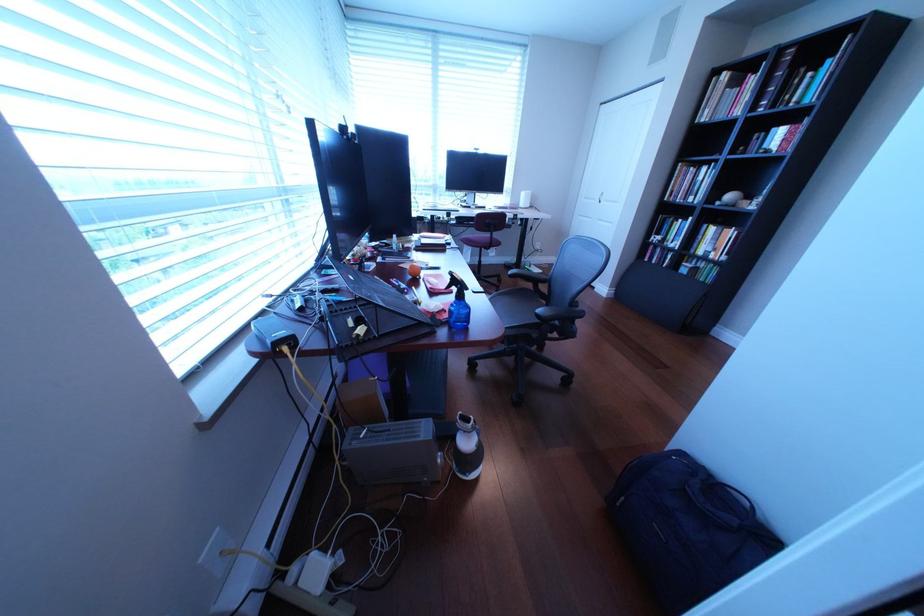
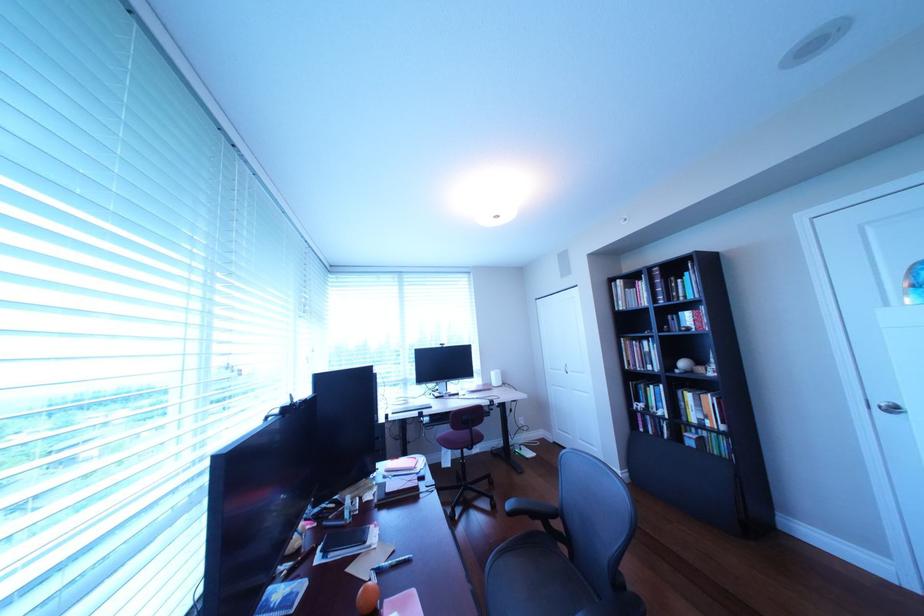
Question: How did the camera likely rotate?

Choices:
 (A) Left
 (B) Right
 (C) Up
 (D) Down

Answer: (C)